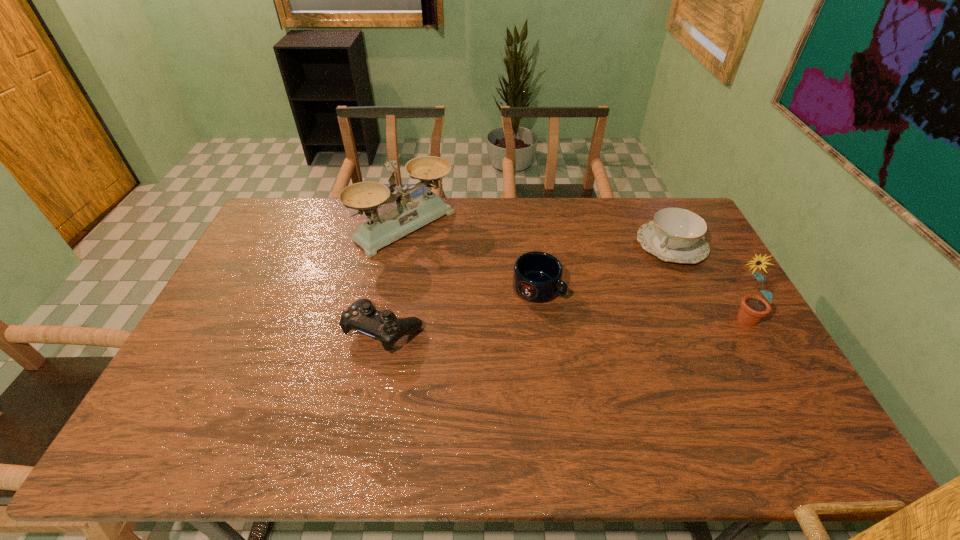
Locate an element on the screen. The width and height of the screenshot is (960, 540). vacant space on the desktop that is between the control and the sunflower and is positioned on the handle side of the chinaware is located at coordinates (592, 324).

Locate an element on the screen. The image size is (960, 540). free spot on the desktop that is between the control and the sunflower and is positioned on the front-facing side of the scale is located at coordinates (538, 325).

You are a GUI agent. You are given a task and a screenshot of the screen. Output one action in this format:
    pyautogui.click(x=<x>, y=<y>)
    Task: Click on the free spot on the desktop that is between the control and the sunflower and is positioned with the handle on the side of the third object from left to right
    
    Given the screenshot: What is the action you would take?
    pyautogui.click(x=601, y=323)